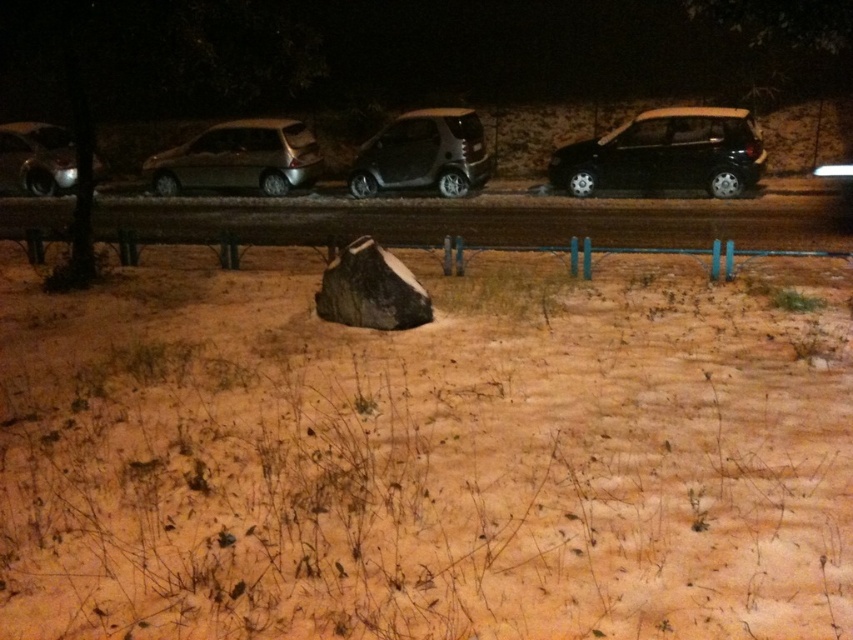
Question: Which of the following is the farthest from the observer?

Choices:
 (A) (434, 604)
 (B) (621, 138)

Answer: (B)

Question: Does metallic silver hatchback at center appear on the right side of shiny silver car at left?

Choices:
 (A) no
 (B) yes

Answer: (B)

Question: Which object appears farthest from the camera in this image?

Choices:
 (A) metallic silver hatchback at center
 (B) brown sandy dirt at center

Answer: (A)

Question: Which of the following is the farthest from the observer?

Choices:
 (A) satin black car at center
 (B) brown sandy dirt at center
 (C) metallic silver hatchback at center

Answer: (C)

Question: Where is black matte hatchback at right located in relation to satin black car at center in the image?

Choices:
 (A) left
 (B) right

Answer: (B)

Question: Is black matte hatchback at right wider than metallic silver hatchback at center?

Choices:
 (A) yes
 (B) no

Answer: (B)